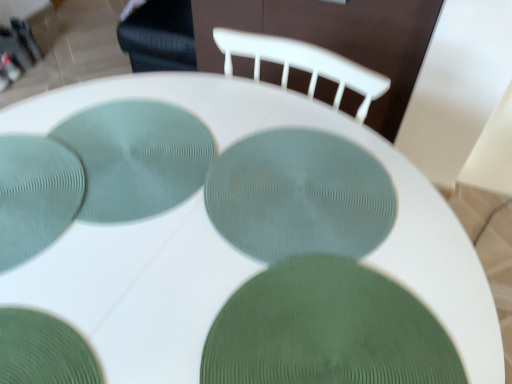
Question: Can you confirm if green textured plate at center, the 5th glass plate positioned from the left, is taller than matte green plate at lower left, marked as the 5th glass plate in a right-to-left arrangement?

Choices:
 (A) yes
 (B) no

Answer: (B)

Question: From the image's perspective, is green textured plate at center, the 5th glass plate positioned from the left, located beneath matte green plate at lower left, marked as the 5th glass plate in a right-to-left arrangement?

Choices:
 (A) no
 (B) yes

Answer: (B)

Question: From the image's perspective, is green textured plate at center, the 5th glass plate positioned from the left, located above matte green plate at lower left, which is the first glass plate in left-to-right order?

Choices:
 (A) yes
 (B) no

Answer: (B)

Question: Is green textured plate at center, marked as the 1th glass plate in a right-to-left arrangement, not inside matte green plate at lower left, which is the first glass plate in left-to-right order?

Choices:
 (A) no
 (B) yes

Answer: (B)

Question: Can you confirm if green textured plate at center, the 5th glass plate positioned from the left, is positioned to the right of matte green plate at lower left, which is the first glass plate in left-to-right order?

Choices:
 (A) yes
 (B) no

Answer: (A)

Question: Is green textured plate at center, marked as the 1th glass plate in a right-to-left arrangement, to the left of matte green plate at lower left, which is the first glass plate in left-to-right order, from the viewer's perspective?

Choices:
 (A) yes
 (B) no

Answer: (B)

Question: Does matte green plate at lower left, which is the first glass plate in left-to-right order, appear on the right side of green textured glass plate at lower left, which ranks as the second glass plate in left-to-right order?

Choices:
 (A) no
 (B) yes

Answer: (A)

Question: Is matte green plate at lower left, which is the first glass plate in left-to-right order, turned away from green textured glass plate at lower left, which ranks as the second glass plate in left-to-right order?

Choices:
 (A) yes
 (B) no

Answer: (B)

Question: Is matte green plate at lower left, marked as the 5th glass plate in a right-to-left arrangement, next to green textured glass plate at lower left, which ranks as the second glass plate in left-to-right order?

Choices:
 (A) yes
 (B) no

Answer: (B)

Question: From the image's perspective, does matte green plate at lower left, which is the first glass plate in left-to-right order, appear higher than green textured glass plate at lower left, which ranks as the second glass plate in left-to-right order?

Choices:
 (A) yes
 (B) no

Answer: (A)

Question: Is matte green plate at lower left, marked as the 5th glass plate in a right-to-left arrangement, wider than green textured glass plate at lower left, the fourth glass plate viewed from the right?

Choices:
 (A) no
 (B) yes

Answer: (A)

Question: Considering the relative sizes of matte green plate at lower left, which is the first glass plate in left-to-right order, and green textured glass plate at lower left, the fourth glass plate viewed from the right, in the image provided, is matte green plate at lower left, which is the first glass plate in left-to-right order, taller than green textured glass plate at lower left, the fourth glass plate viewed from the right,?

Choices:
 (A) yes
 (B) no

Answer: (A)

Question: Is green textured plate at center, the 5th glass plate positioned from the left, to the right of teal textured placemat at center, the third glass plate viewed from the left, from the viewer's perspective?

Choices:
 (A) no
 (B) yes

Answer: (B)